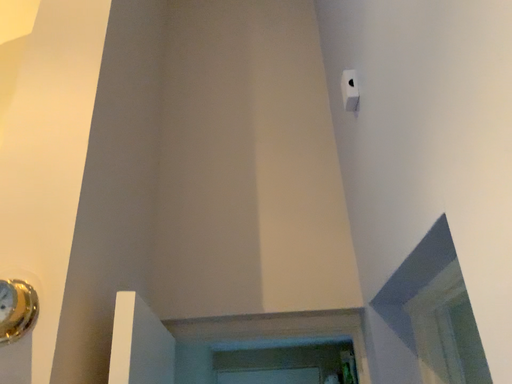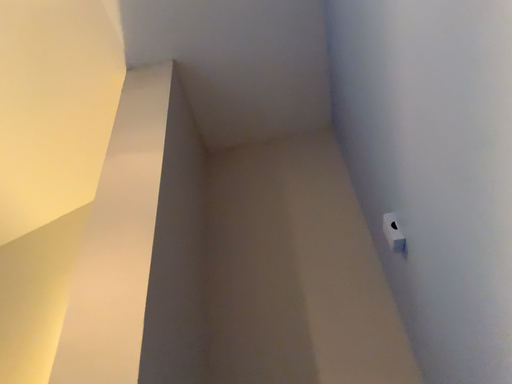
Question: Which way did the camera rotate in the video?

Choices:
 (A) rotated upward
 (B) rotated downward

Answer: (A)